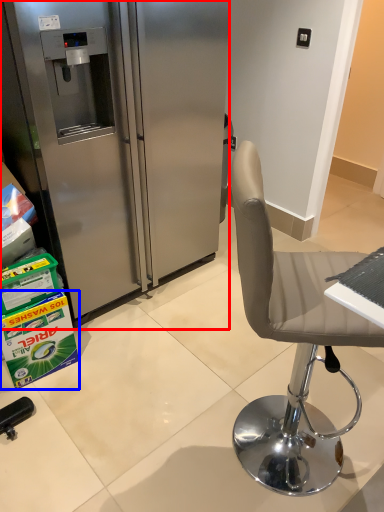
Question: Which of the following is the farthest to the observer, refrigerator (highlighted by a red box) or box (highlighted by a blue box)?

Choices:
 (A) refrigerator
 (B) box

Answer: (B)